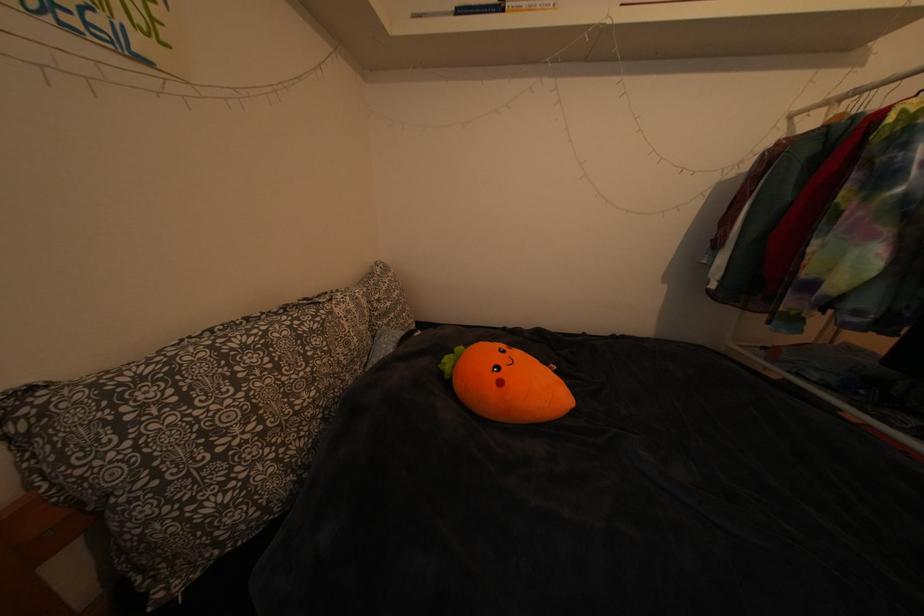
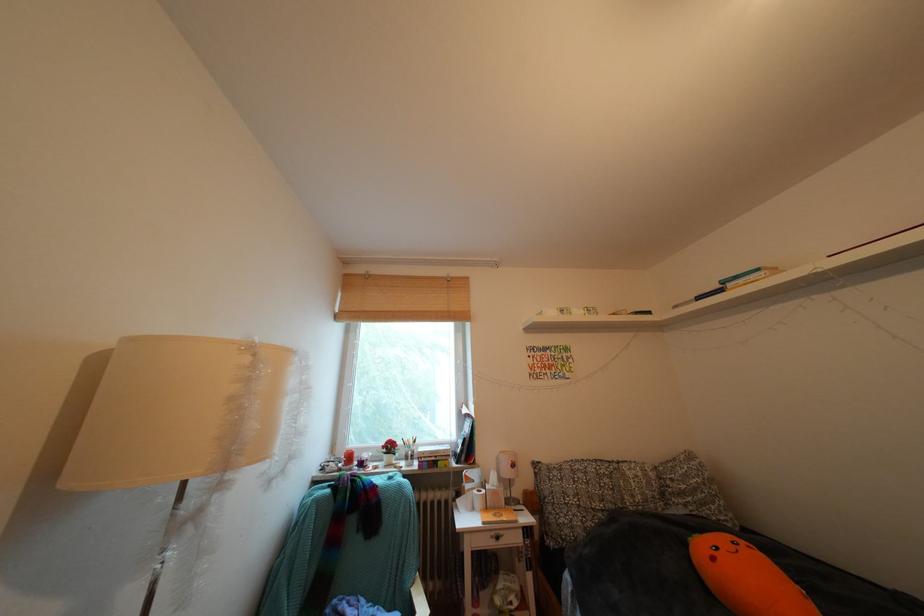
The point at (511, 389) is marked in the first image. Where is the corresponding point in the second image?

(723, 564)